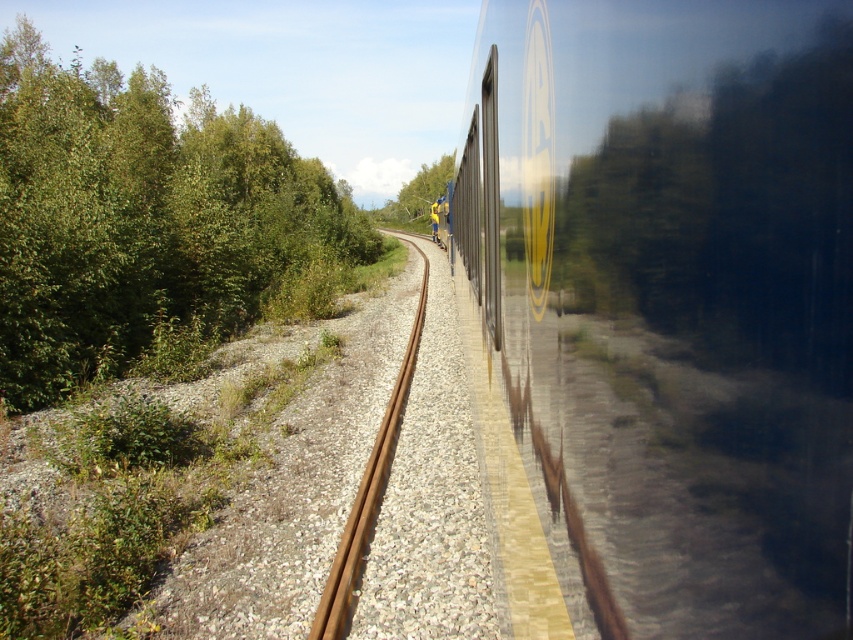
You are a passenger sitting in the train and looking out the window. You see the rusty metal train track at center and the green leafy tree at center. Which object is closer to the right edge of the window?

The rusty metal train track at center is positioned on the right side of green leafy tree at center, so it is closer to the right edge of the window.

You are standing on the train platform and see the point marked at coordinates (675, 301) in the image. Is this point located on the train or the surrounding environment?

The point at coordinates (675, 301) is on the metallic silver train at right, so it is located on the train.

You are a passenger on the metallic silver train at right and want to know if you can see the top of the rusty metal train track at center through the window. Can you see the top of the track?

The metallic silver train at right is not as tall as the rusty metal train track at center, so yes, you can see the top of the rusty metal train track at center through the window.